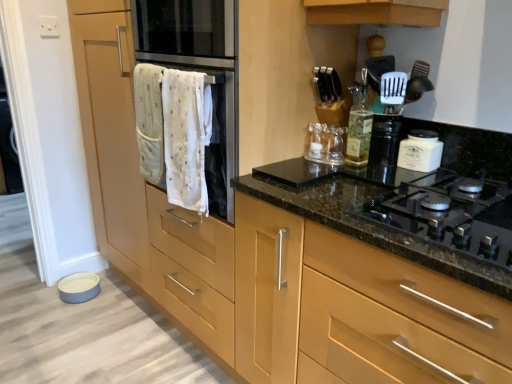
Question: Can you confirm if white plastic spatula at upper right is taller than translucent glass bottle at upper center?

Choices:
 (A) no
 (B) yes

Answer: (A)

Question: Can you confirm if white plastic spatula at upper right is wider than translucent glass bottle at upper center?

Choices:
 (A) no
 (B) yes

Answer: (A)

Question: From the image's perspective, is white plastic spatula at upper right over translucent glass bottle at upper center?

Choices:
 (A) no
 (B) yes

Answer: (B)

Question: Is white plastic spatula at upper right smaller than translucent glass bottle at upper center?

Choices:
 (A) yes
 (B) no

Answer: (A)

Question: Can we say white plastic spatula at upper right lies outside translucent glass bottle at upper center?

Choices:
 (A) no
 (B) yes

Answer: (B)

Question: Considering their positions, is white plastic spatula at upper right located in front of or behind white cloth oven at center?

Choices:
 (A) behind
 (B) front

Answer: (A)

Question: Considering the positions of point (379, 84) and point (221, 59), is point (379, 84) closer or farther from the camera than point (221, 59)?

Choices:
 (A) closer
 (B) farther

Answer: (B)

Question: Considering the positions of white plastic spatula at upper right and white cloth oven at center in the image, is white plastic spatula at upper right taller or shorter than white cloth oven at center?

Choices:
 (A) short
 (B) tall

Answer: (A)

Question: Is white plastic spatula at upper right wider or thinner than white cloth oven at center?

Choices:
 (A) wide
 (B) thin

Answer: (B)

Question: From the image's perspective, relative to white matte jar at upper right, is translucent glass bottle at upper center above or below?

Choices:
 (A) above
 (B) below

Answer: (A)

Question: Based on their positions, is translucent glass bottle at upper center located to the left or right of white matte jar at upper right?

Choices:
 (A) left
 (B) right

Answer: (A)

Question: In terms of size, does translucent glass bottle at upper center appear bigger or smaller than white matte jar at upper right?

Choices:
 (A) small
 (B) big

Answer: (B)

Question: From a real-world perspective, relative to white matte jar at upper right, is translucent glass bottle at upper center vertically above or below?

Choices:
 (A) below
 (B) above

Answer: (B)

Question: Based on their sizes in the image, would you say white quilted towel at center, which is counted as the first bath towel, starting from the left, is bigger or smaller than white cloth oven at center?

Choices:
 (A) big
 (B) small

Answer: (B)

Question: Considering their positions, is white quilted towel at center, the second bath towel when ordered from right to left, located in front of or behind white cloth oven at center?

Choices:
 (A) behind
 (B) front

Answer: (A)